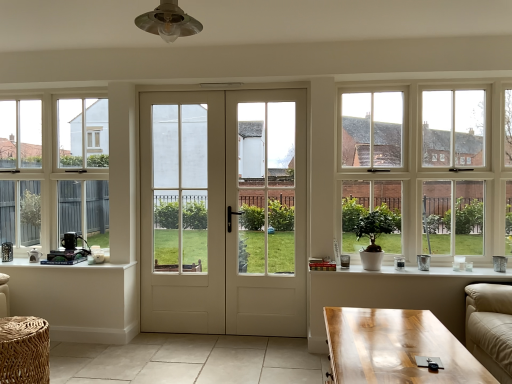
I want to click on free space above light brown wooden coffee table at lower right (from a real-world perspective), so click(388, 338).